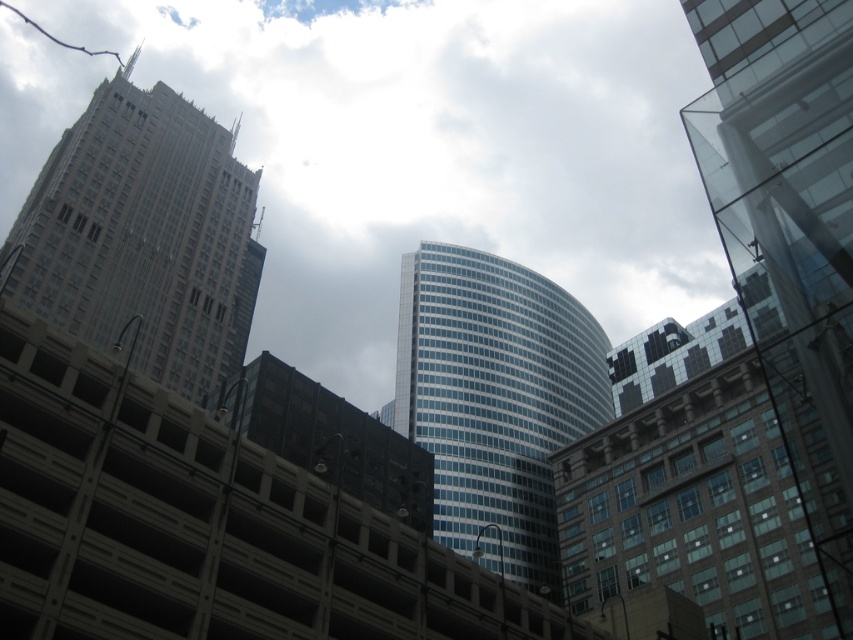
You are a drone operator who needs to fly a drone from the gray stone skyscraper at left to the glassy blue skyscraper at center. Based on the scene, which direction should you fly the drone to reach the destination?

The gray stone skyscraper at left is to the left of the glassy blue skyscraper at center, so you should fly the drone to the right to reach the destination.

You are an architect evaluating the city skyline. You notice the transparent glass building at upper center and the glassy blue skyscraper at center. Which one appears to be the taller structure in the image?

The transparent glass building at upper center is taller than the glassy blue skyscraper at center according to the description.